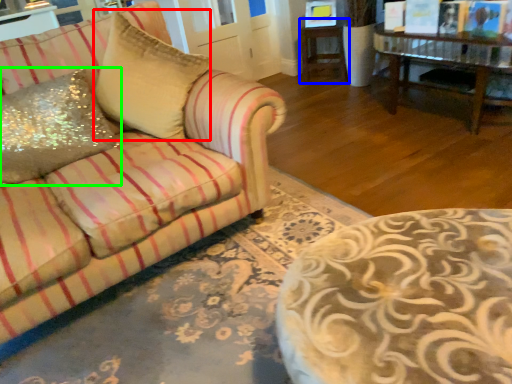
Question: Based on their relative distances, which object is nearer to throw pillow (highlighted by a red box)? Choose from side table (highlighted by a blue box) and throw pillow (highlighted by a green box).

Choices:
 (A) side table
 (B) throw pillow

Answer: (B)